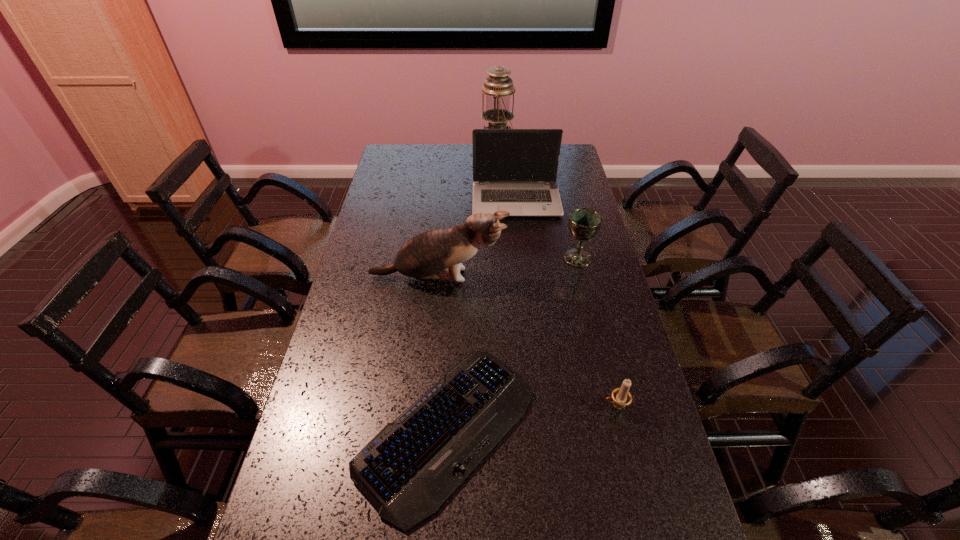
The width and height of the screenshot is (960, 540). I want to click on free space between the cat and the oil lamp, so click(x=468, y=215).

What are the coordinates of `free space between the cat and the tallest object` in the screenshot? It's located at (468, 215).

Locate which object is the third closest to the laptop computer. Please provide its 2D coordinates. Your answer should be formatted as a tuple, i.e. [(x, y)], where the tuple contains the x and y coordinates of a point satisfying the conditions above.

[(430, 255)]

This screenshot has width=960, height=540. Identify the location of object that is the third closest one to the cat. (515, 170).

Find the location of a particular element. This screenshot has height=540, width=960. vacant space that satisfies the following two spatial constraints: 1. on the handle side of the second shortest object; 2. on the front side of the computer keyboard is located at coordinates (621, 430).

Locate an element on the screen. free point that satisfies the following two spatial constraints: 1. on the screen of the fifth nearest object; 2. on the right side of the chalice is located at coordinates (522, 258).

Locate an element on the screen. vacant area in the image that satisfies the following two spatial constraints: 1. on the screen of the laptop computer; 2. at the face of the cat is located at coordinates (524, 277).

The width and height of the screenshot is (960, 540). What are the coordinates of `vacant space that satisfies the following two spatial constraints: 1. at the face of the cat; 2. on the left side of the shortest object` in the screenshot? It's located at (423, 430).

The height and width of the screenshot is (540, 960). Identify the location of vacant area in the image that satisfies the following two spatial constraints: 1. on the screen of the fifth nearest object; 2. on the right side of the chalice. (522, 258).